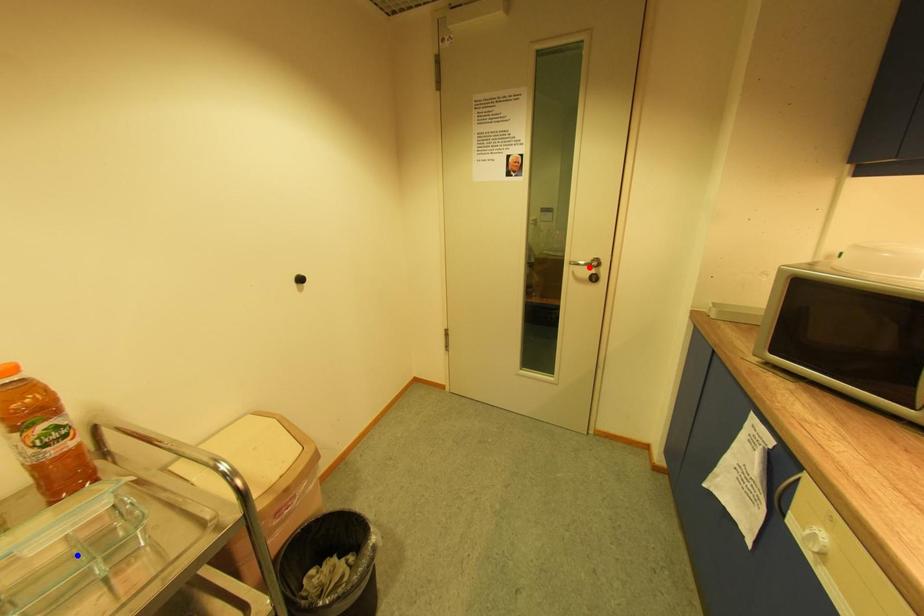
Question: Two points are marked on the image. Which point is closer to the camera?

Choices:
 (A) Blue point is closer.
 (B) Red point is closer.

Answer: (A)